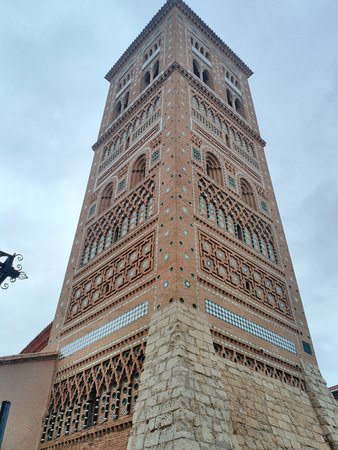
This screenshot has width=338, height=450. Identify the location of ledge. (126, 109), (220, 101).